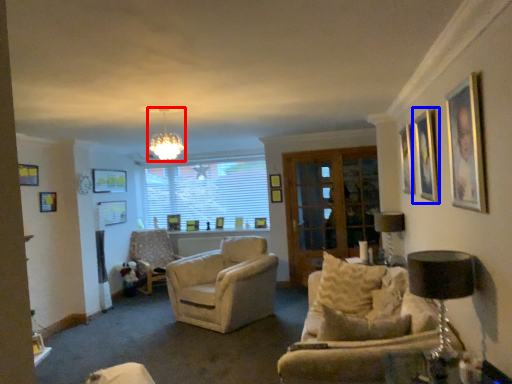
Question: Which point is further to the camera, light fixture (highlighted by a red box) or picture frame (highlighted by a blue box)?

Choices:
 (A) light fixture
 (B) picture frame

Answer: (A)